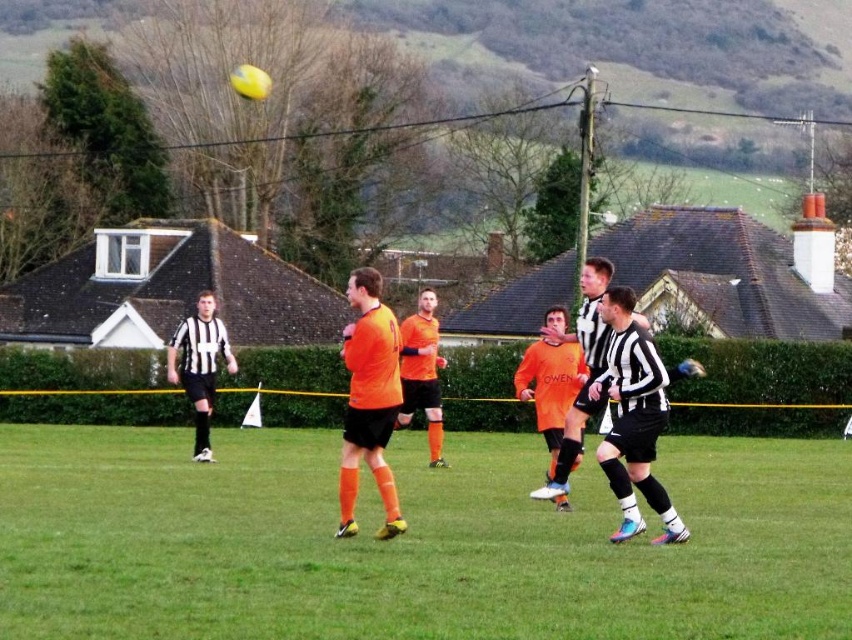
Can you confirm if black and white striped shirt at center is positioned to the right of matte black jersey at left?

Yes, black and white striped shirt at center is to the right of matte black jersey at left.

Can you confirm if black and white striped shirt at center is wider than matte black jersey at left?

No, black and white striped shirt at center is not wider than matte black jersey at left.

Is point (596, 333) behind point (222, 340)?

No, (596, 333) is closer to viewer.

The width and height of the screenshot is (852, 640). I want to click on black and white striped shirt at center, so click(585, 365).

Does green grass at center have a lesser height compared to orange matte jersey at center?

Yes.

Is green grass at center closer to the viewer compared to orange matte jersey at center?

That is True.

This screenshot has width=852, height=640. Find the location of `green grass at center`. green grass at center is located at coordinates (410, 541).

This screenshot has height=640, width=852. In order to click on green grass at center in this screenshot , I will do `click(410, 541)`.

Can you confirm if orange matte jersey at center is smaller than black and white striped shirt at center?

Actually, orange matte jersey at center might be larger than black and white striped shirt at center.

Is orange matte jersey at center wider than black and white striped shirt at center?

Yes.

Is point (349, 292) positioned in front of point (586, 324)?

Yes, it is in front of point (586, 324).

Locate an element on the screen. This screenshot has height=640, width=852. orange matte jersey at center is located at coordinates (369, 400).